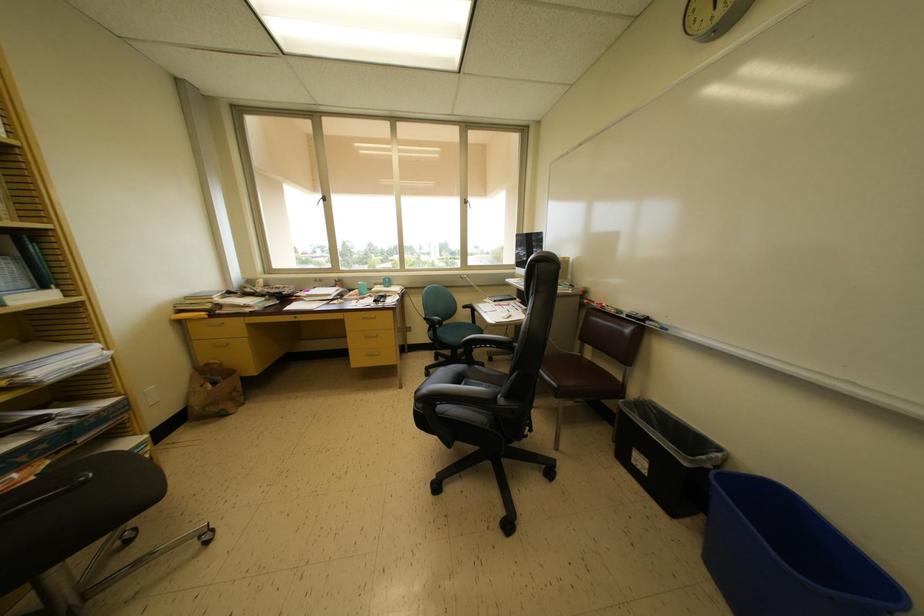
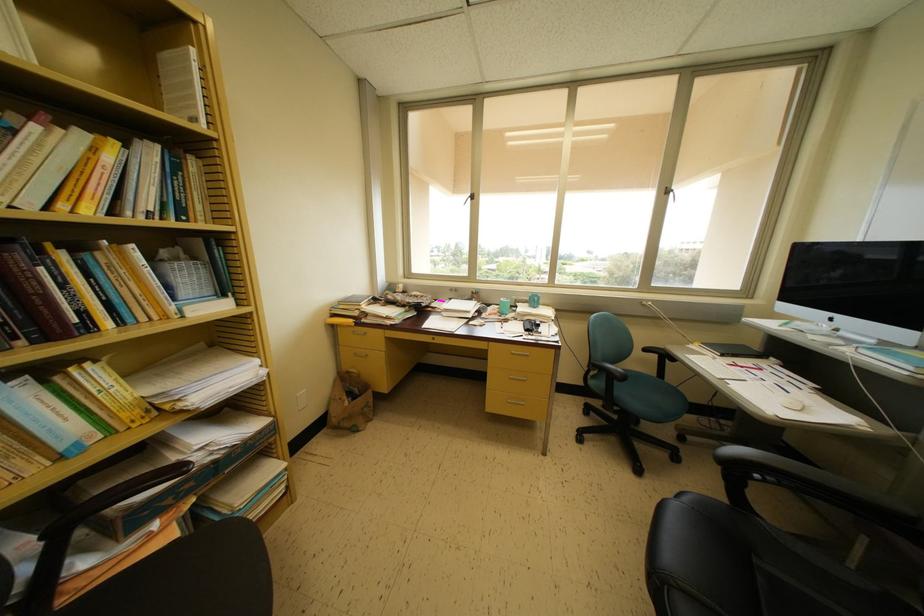
Locate, in the second image, the point that corresponds to (x=200, y=413) in the first image.

(337, 424)